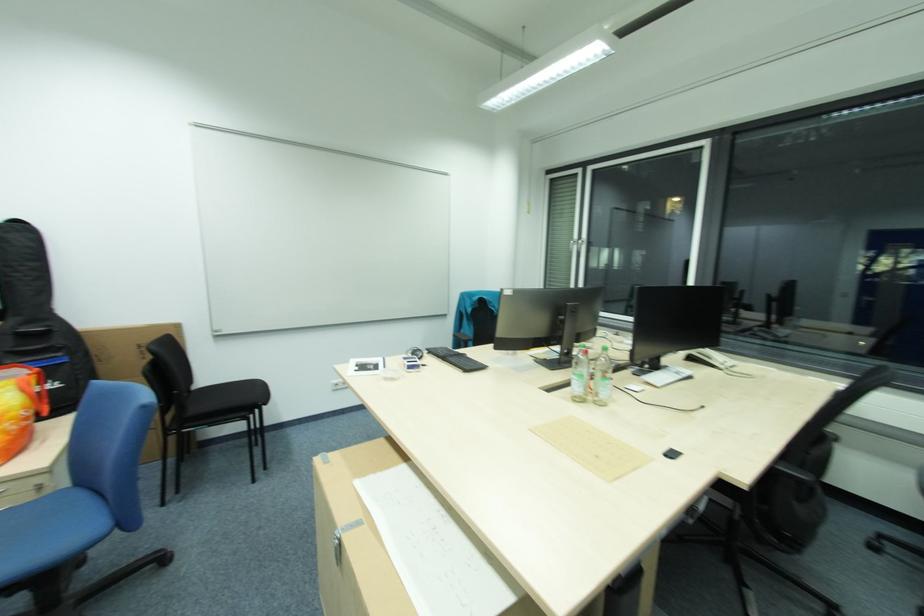
Where would you unlatch the metal box latch? Please return your answer as a coordinate pair (x, y).

(341, 540)